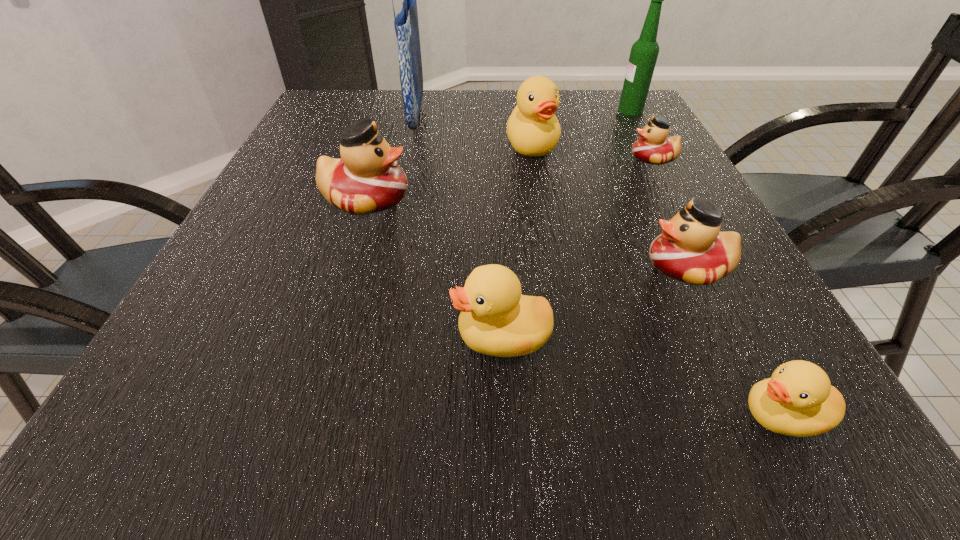
At what (x,y) coordinates should I click in order to perform the action: click on the tallest object. Please return your answer as a coordinate pair (x, y). Image resolution: width=960 pixels, height=540 pixels. Looking at the image, I should click on (406, 25).

Where is `the seventh shortest object`? the seventh shortest object is located at coordinates (644, 52).

Image resolution: width=960 pixels, height=540 pixels. Identify the location of green beer bottle. (644, 52).

This screenshot has width=960, height=540. I want to click on the biggest red duck, so click(366, 179).

Image resolution: width=960 pixels, height=540 pixels. I want to click on the leftmost duck, so click(366, 179).

At what (x,y) coordinates should I click in order to perform the action: click on the farthest yellow duck. Please return your answer as a coordinate pair (x, y). The image size is (960, 540). Looking at the image, I should click on (533, 130).

At what (x,y) coordinates should I click in order to perform the action: click on the fourth farthest duck. Please return your answer as a coordinate pair (x, y). Looking at the image, I should click on (691, 249).

At what (x,y) coordinates should I click in order to perform the action: click on the second smallest red duck. Please return your answer as a coordinate pair (x, y). The height and width of the screenshot is (540, 960). Looking at the image, I should click on (691, 249).

Locate an element on the screen. The height and width of the screenshot is (540, 960). the second nearest object is located at coordinates (495, 319).

Where is `the fifth farthest duck`? the fifth farthest duck is located at coordinates (495, 319).